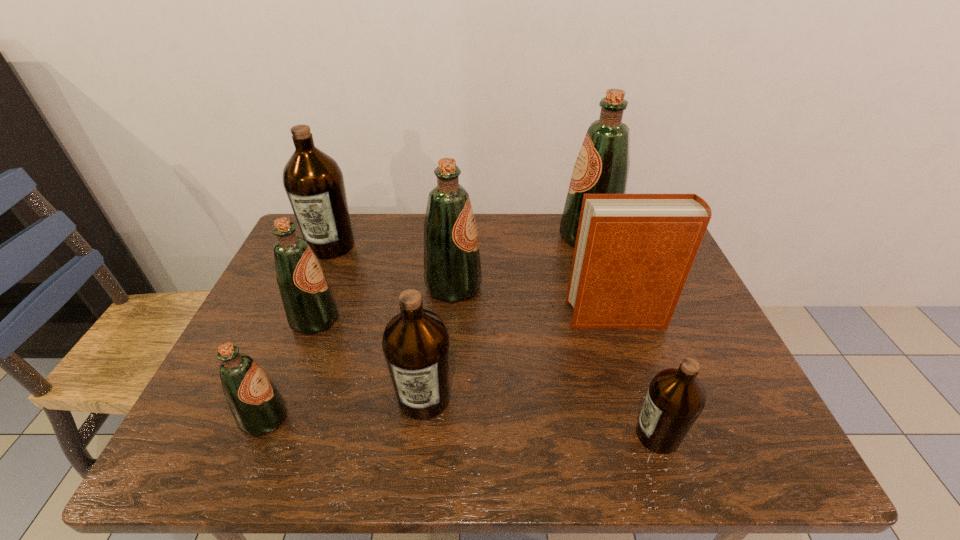
Where is `vacant space located 0.340m on the label of the rightmost brown olive oil`? The width and height of the screenshot is (960, 540). vacant space located 0.340m on the label of the rightmost brown olive oil is located at coordinates (465, 435).

Where is `free space located 0.280m on the label of the rightmost brown olive oil`? The image size is (960, 540). free space located 0.280m on the label of the rightmost brown olive oil is located at coordinates (494, 435).

Where is `blank space located on the label of the rightmost brown olive oil`? The height and width of the screenshot is (540, 960). blank space located on the label of the rightmost brown olive oil is located at coordinates (554, 435).

Find the location of a particular element. olive oil that is at the right edge is located at coordinates (602, 166).

In order to click on hardback book located at the right edge in this screenshot , I will do coord(633,253).

At what (x,y) coordinates should I click in order to perform the action: click on object that is at the far left corner. Please return your answer as a coordinate pair (x, y). The image size is (960, 540). Looking at the image, I should click on (314, 183).

Image resolution: width=960 pixels, height=540 pixels. Find the location of `object situated at the near left corner`. object situated at the near left corner is located at coordinates coord(258,408).

This screenshot has height=540, width=960. In order to click on object that is at the far right corner in this screenshot , I will do `click(602, 166)`.

In the image, there is a desktop. At what (x,y) coordinates should I click in order to perform the action: click on vacant space at the far edge. Please return your answer as a coordinate pair (x, y). Image resolution: width=960 pixels, height=540 pixels. Looking at the image, I should click on (389, 255).

Where is `vacant space at the near edge of the desktop`? Image resolution: width=960 pixels, height=540 pixels. vacant space at the near edge of the desktop is located at coordinates (331, 441).